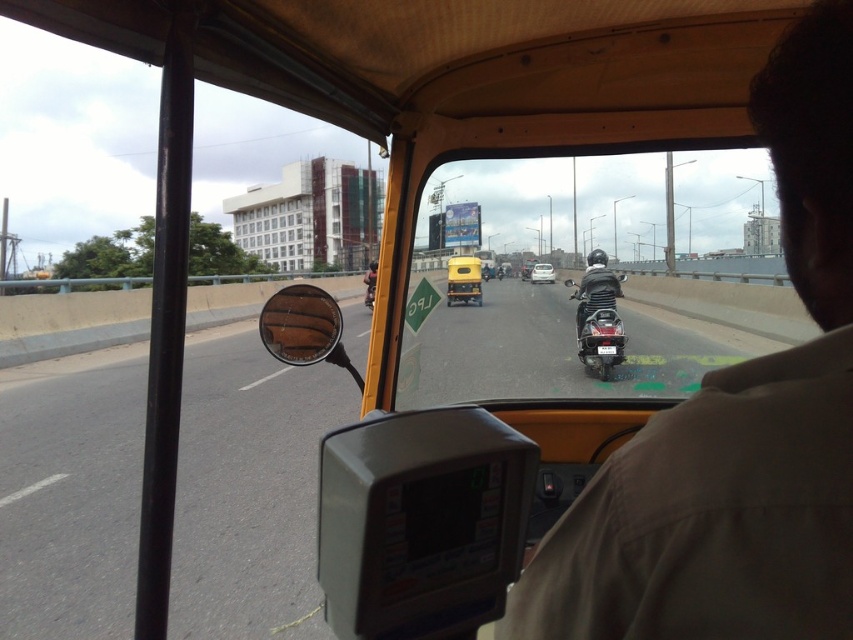
Can you confirm if black rubber view mirror at left is positioned to the left of metallic silver car at center?

Correct, you'll find black rubber view mirror at left to the left of metallic silver car at center.

Does black rubber view mirror at left have a larger size compared to metallic silver car at center?

Indeed, black rubber view mirror at left has a larger size compared to metallic silver car at center.

Is point (277, 326) closer to camera compared to point (547, 278)?

Yes, it is.

This screenshot has height=640, width=853. What are the coordinates of `black rubber view mirror at left` in the screenshot? It's located at (305, 328).

Which is above, light brown leather jacket at upper right or black rubber view mirror at left?

light brown leather jacket at upper right is higher up.

Between point (837, 509) and point (328, 305), which one is positioned in front?

Point (837, 509)

I want to click on light brown leather jacket at upper right, so click(x=735, y=428).

Between light brown leather jacket at upper right and transparent glass windshield at center, which one appears on the right side from the viewer's perspective?

Positioned to the right is transparent glass windshield at center.

Is point (527, 632) closer to camera compared to point (445, 291)?

Yes, point (527, 632) is in front of point (445, 291).

Locate an element on the screen. The image size is (853, 640). light brown leather jacket at upper right is located at coordinates (735, 428).